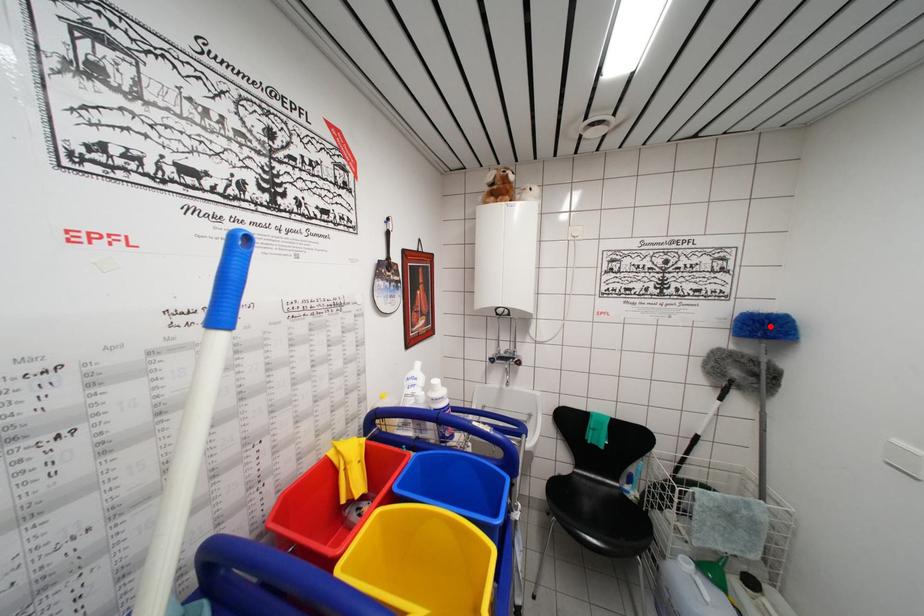
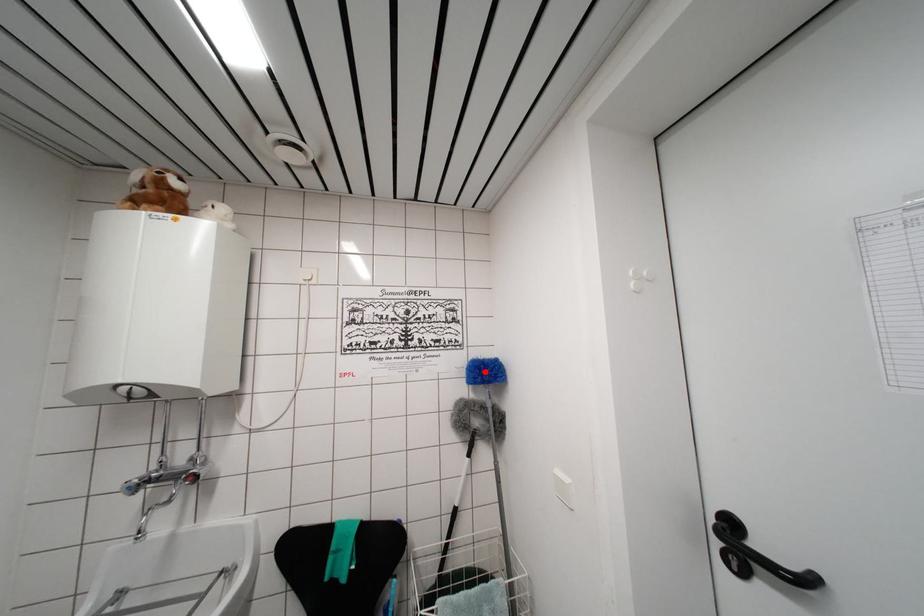
I am providing you with two images of the same scene from different viewpoints. A red point is marked on the first image and another point is marked on the second image. Does the point marked in image1 correspond to the same location as the one in image2?

Yes